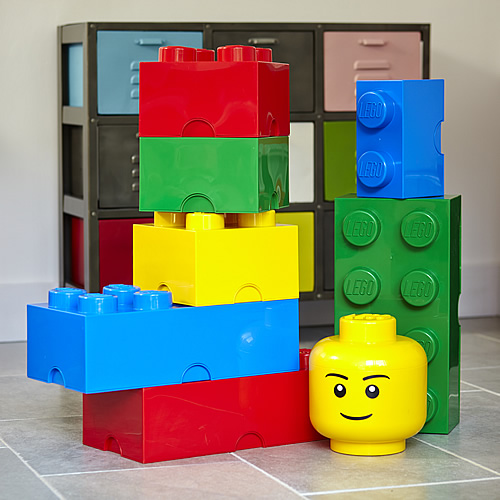
Identify the location of drawer. (335, 84), (119, 258).